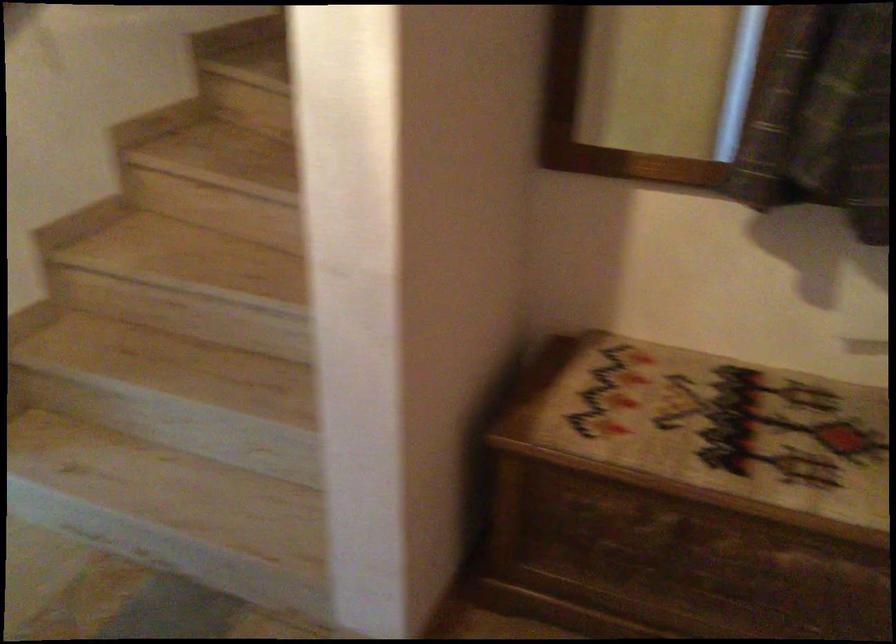
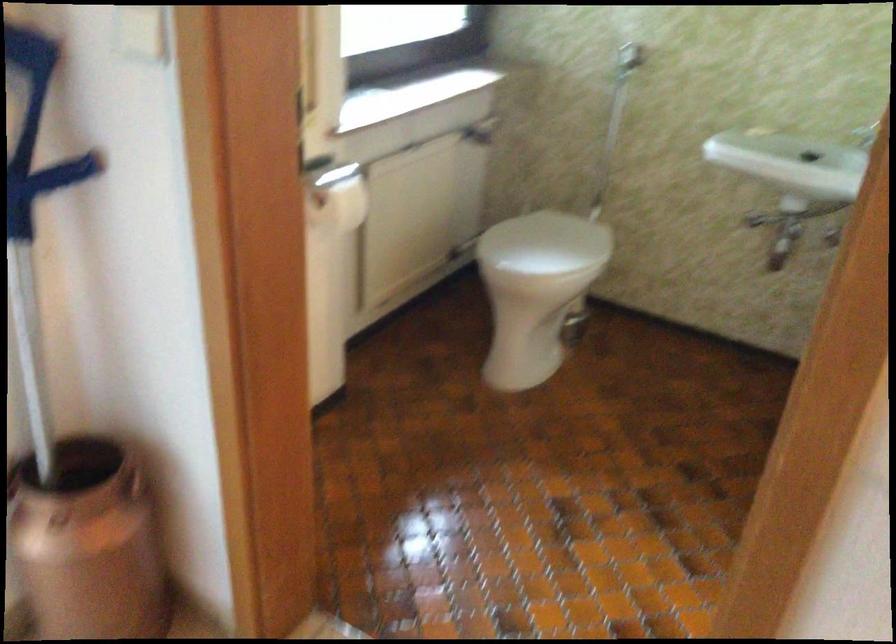
In a continuous first-person perspective shot, in which direction is the camera moving?

The cameraman moved toward left, forward.